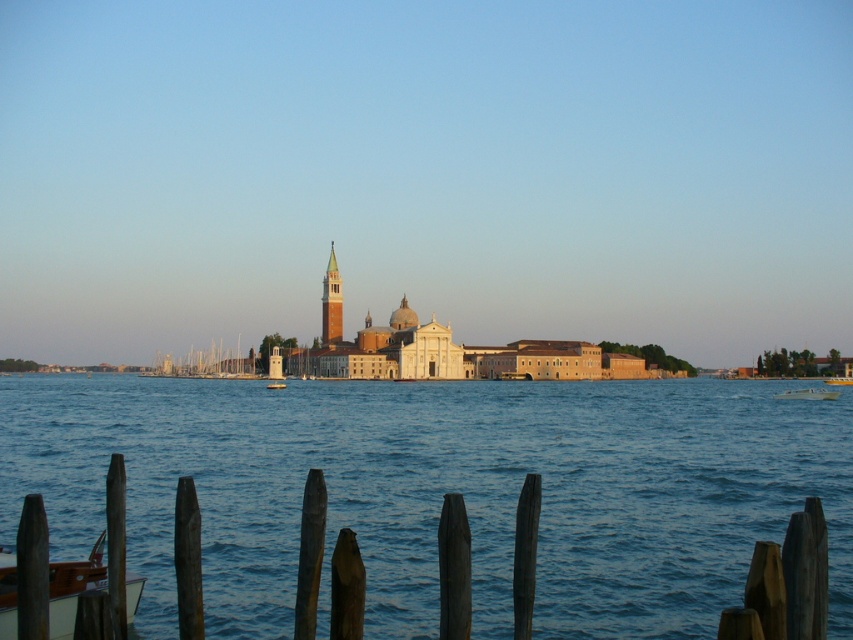
Find the location of a particular element. Image resolution: width=853 pixels, height=640 pixels. golden brick bell tower at center is located at coordinates (331, 304).

Which of these two, golden brick bell tower at center or wooden boat at center, stands shorter?

With less height is wooden boat at center.

This screenshot has width=853, height=640. I want to click on golden brick bell tower at center, so click(x=331, y=304).

Where is `golden brick bell tower at center`? This screenshot has width=853, height=640. golden brick bell tower at center is located at coordinates (331, 304).

Does golden brick bell tower at center appear over yellow plastic boat at center?

Yes, golden brick bell tower at center is above yellow plastic boat at center.

Which of these two, golden brick bell tower at center or yellow plastic boat at center, stands taller?

With more height is golden brick bell tower at center.

This screenshot has width=853, height=640. Describe the element at coordinates (331, 304) in the screenshot. I see `golden brick bell tower at center` at that location.

Locate an element on the screen. This screenshot has height=640, width=853. golden brick bell tower at center is located at coordinates (331, 304).

Can you confirm if wooden posts at lower center is taller than yellow plastic boat at center?

Yes.

Is wooden posts at lower center below yellow plastic boat at center?

Yes, wooden posts at lower center is below yellow plastic boat at center.

Where is `wooden posts at lower center`? The height and width of the screenshot is (640, 853). wooden posts at lower center is located at coordinates (785, 582).